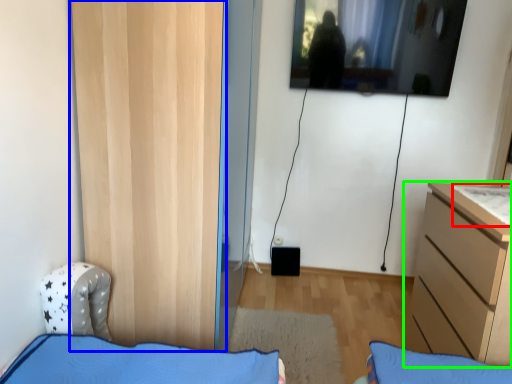
Question: Which object is the closest to the sheet (highlighted by a red box)? Choose among these: door (highlighted by a blue box) or chest of drawers (highlighted by a green box).

Choices:
 (A) door
 (B) chest of drawers

Answer: (B)